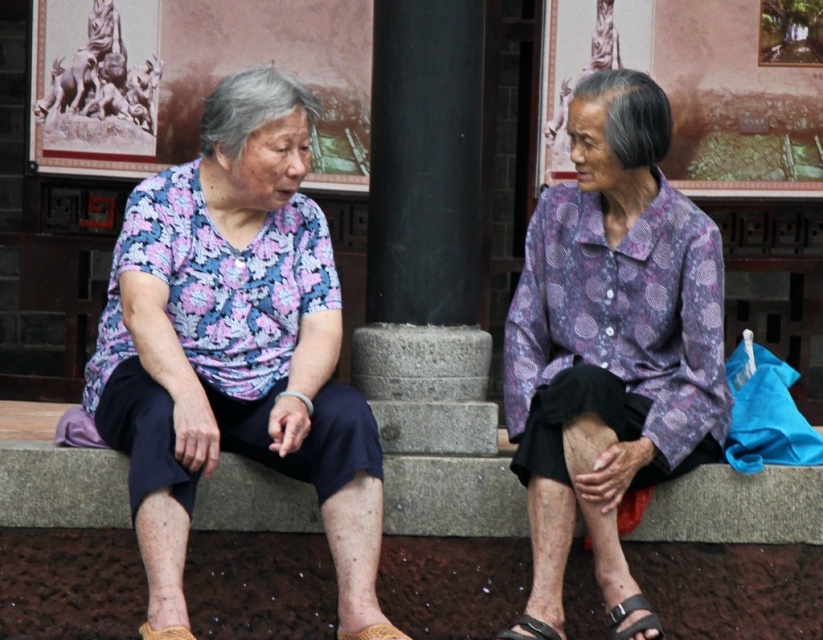
Question: Can you confirm if black leather sandal at lower center is wider than brown leather sandal at lower center?

Choices:
 (A) yes
 (B) no

Answer: (B)

Question: Does printed fabric blouse at left appear on the right side of yellow knitted sandal at lower left?

Choices:
 (A) no
 (B) yes

Answer: (B)

Question: Among these points, which one is farthest from the camera?

Choices:
 (A) (538, 620)
 (B) (184, 634)
 (C) (352, 636)

Answer: (A)

Question: Which point is closer to the camera?

Choices:
 (A) printed fabric blouse at left
 (B) purple printed shirt at center
 (C) yellow knitted sandal at lower left

Answer: (C)

Question: Can you confirm if printed fabric blouse at left is thinner than purple printed shirt at center?

Choices:
 (A) yes
 (B) no

Answer: (B)

Question: Which object is the farthest from the purple printed shirt at center?

Choices:
 (A) printed fabric blouse at left
 (B) brown leather sandal at lower center
 (C) black leather sandal at lower right
 (D) black leather sandal at lower center

Answer: (B)